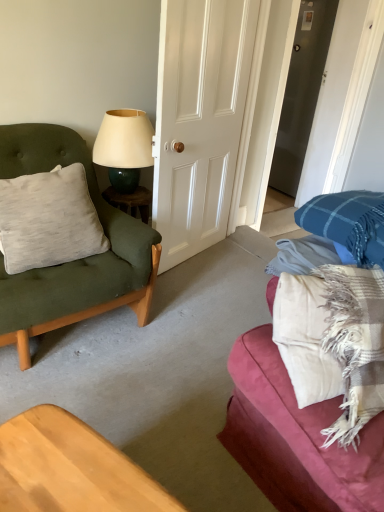
Question: Does matte cream lampshade at upper center lie behind light gray cotton pillow at left?

Choices:
 (A) yes
 (B) no

Answer: (A)

Question: Is matte cream lampshade at upper center bigger than light gray cotton pillow at left?

Choices:
 (A) no
 (B) yes

Answer: (A)

Question: Is matte cream lampshade at upper center thinner than light gray cotton pillow at left?

Choices:
 (A) yes
 (B) no

Answer: (B)

Question: Is matte cream lampshade at upper center taller than light gray cotton pillow at left?

Choices:
 (A) no
 (B) yes

Answer: (A)

Question: Is matte cream lampshade at upper center closer to the viewer compared to light gray cotton pillow at left?

Choices:
 (A) no
 (B) yes

Answer: (A)

Question: Considering the relative sizes of matte cream lampshade at upper center and light gray cotton pillow at left in the image provided, is matte cream lampshade at upper center wider than light gray cotton pillow at left?

Choices:
 (A) yes
 (B) no

Answer: (A)

Question: Is plaid fabric couch at right positioned behind matte green cushion at left?

Choices:
 (A) yes
 (B) no

Answer: (B)

Question: Are plaid fabric couch at right and matte green cushion at left far apart?

Choices:
 (A) yes
 (B) no

Answer: (B)

Question: Is plaid fabric couch at right in front of matte green cushion at left?

Choices:
 (A) no
 (B) yes

Answer: (B)

Question: Can you confirm if plaid fabric couch at right is bigger than matte green cushion at left?

Choices:
 (A) yes
 (B) no

Answer: (A)

Question: Is plaid fabric couch at right taller than matte green cushion at left?

Choices:
 (A) yes
 (B) no

Answer: (B)

Question: Is plaid fabric couch at right at the right side of matte green cushion at left?

Choices:
 (A) no
 (B) yes

Answer: (B)

Question: From the image's perspective, is plaid fabric couch at right on light gray cotton pillow at left?

Choices:
 (A) no
 (B) yes

Answer: (A)